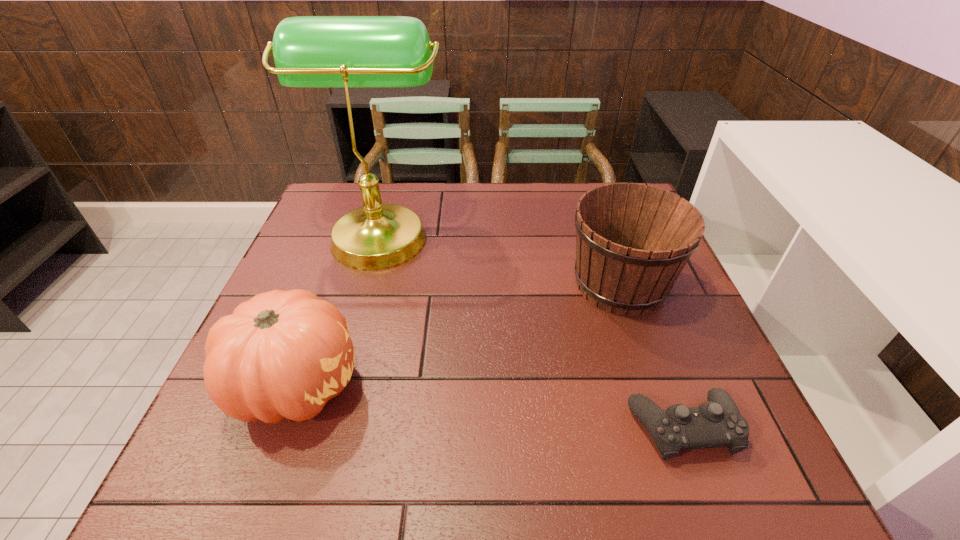
Locate an element on the screen. This screenshot has height=540, width=960. control positioned at the near edge is located at coordinates (717, 423).

This screenshot has width=960, height=540. Identify the location of lamp present at the left edge. (309, 51).

Where is `pumpkin that is at the left edge`? pumpkin that is at the left edge is located at coordinates (282, 354).

Image resolution: width=960 pixels, height=540 pixels. I want to click on wine bucket present at the right edge, so click(x=632, y=241).

Find the location of a particular element. The image size is (960, 540). control located at the right edge is located at coordinates (717, 423).

At what (x,y) coordinates should I click in order to perform the action: click on object at the far left corner. Please return your answer as a coordinate pair (x, y). Looking at the image, I should click on (309, 51).

Image resolution: width=960 pixels, height=540 pixels. What are the coordinates of `object that is at the near left corner` in the screenshot? It's located at (282, 354).

Image resolution: width=960 pixels, height=540 pixels. Identify the location of object at the near right corner. (717, 423).

Find the location of a particular element. This screenshot has height=540, width=960. vacant space at the far edge is located at coordinates (442, 205).

You are a GUI agent. You are given a task and a screenshot of the screen. Output one action in this format:
    pyautogui.click(x=<x>, y=<y>)
    Task: Click on the vacant area at the near edge
    This screenshot has height=540, width=960.
    Given the screenshot: What is the action you would take?
    pyautogui.click(x=474, y=473)